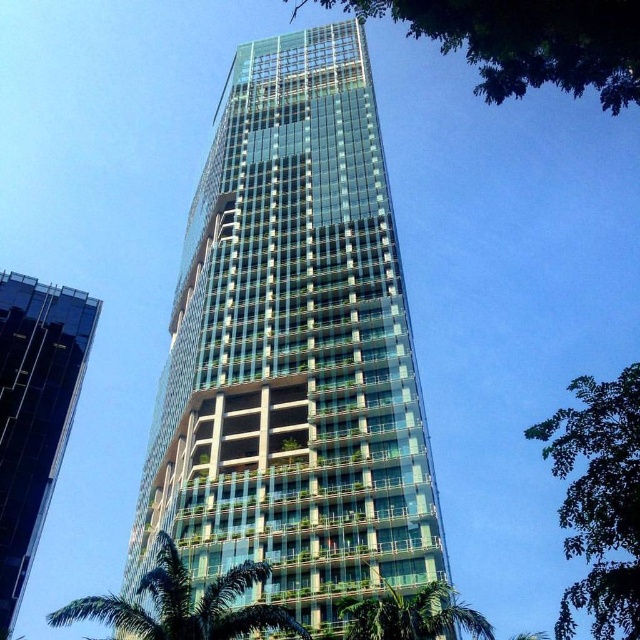
Which is above, green leafy tree at upper center or green leafy tree at upper right?

green leafy tree at upper center is higher up.

What do you see at coordinates (525, 42) in the screenshot? The height and width of the screenshot is (640, 640). I see `green leafy tree at upper center` at bounding box center [525, 42].

I want to click on green leafy tree at upper center, so click(525, 42).

Is transparent glass building at left bigger than green leafy tree at upper right?

No.

Is point (38, 476) more distant than point (634, 381)?

Yes, it is behind point (634, 381).

Describe the element at coordinates (35, 413) in the screenshot. The height and width of the screenshot is (640, 640). I see `transparent glass building at left` at that location.

Where is `transparent glass building at left`? The width and height of the screenshot is (640, 640). transparent glass building at left is located at coordinates (35, 413).

Is green leafy tree at upper right positioned at the back of green leafy palm tree at lower left?

No, it is not.

Who is more distant from viewer, [620,481] or [173,588]?

The point [173,588] is behind.

This screenshot has height=640, width=640. Identify the location of green leafy tree at upper right. (600, 499).